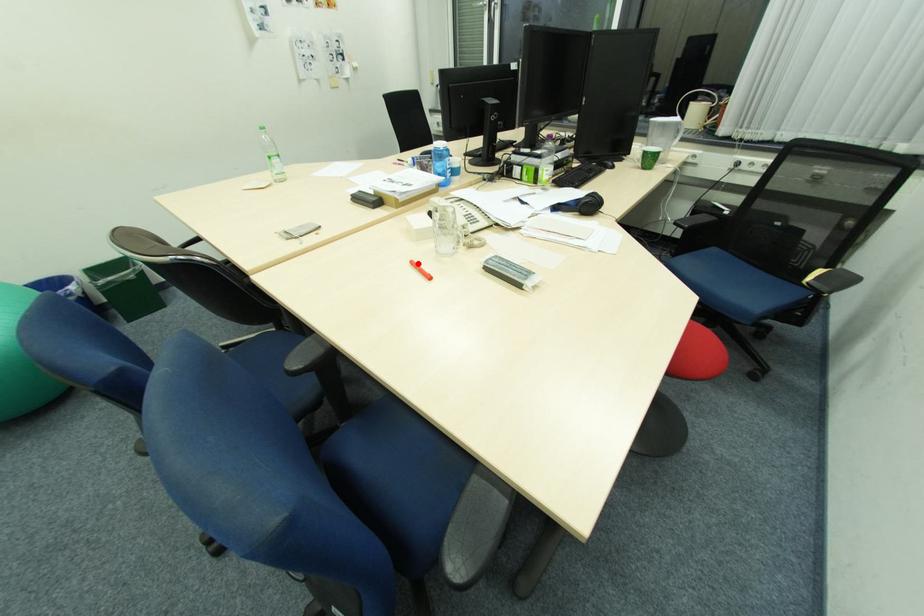
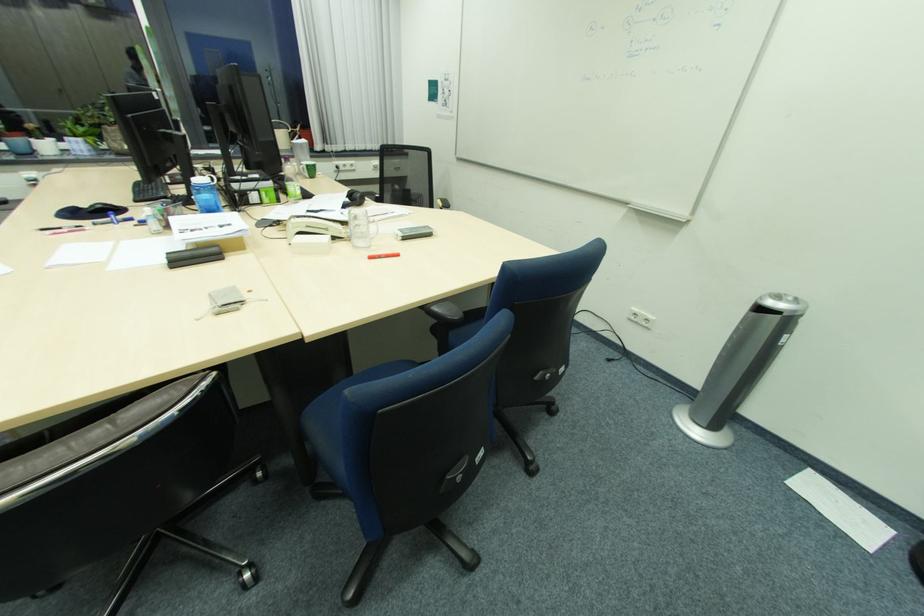
In the second image, find the point that corresponds to the highlighted location in the first image.

(377, 257)